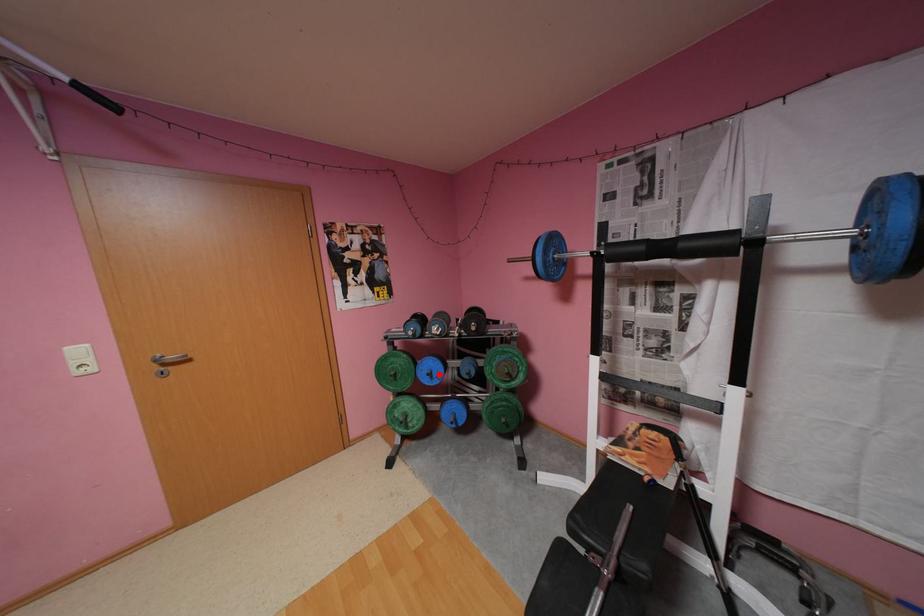
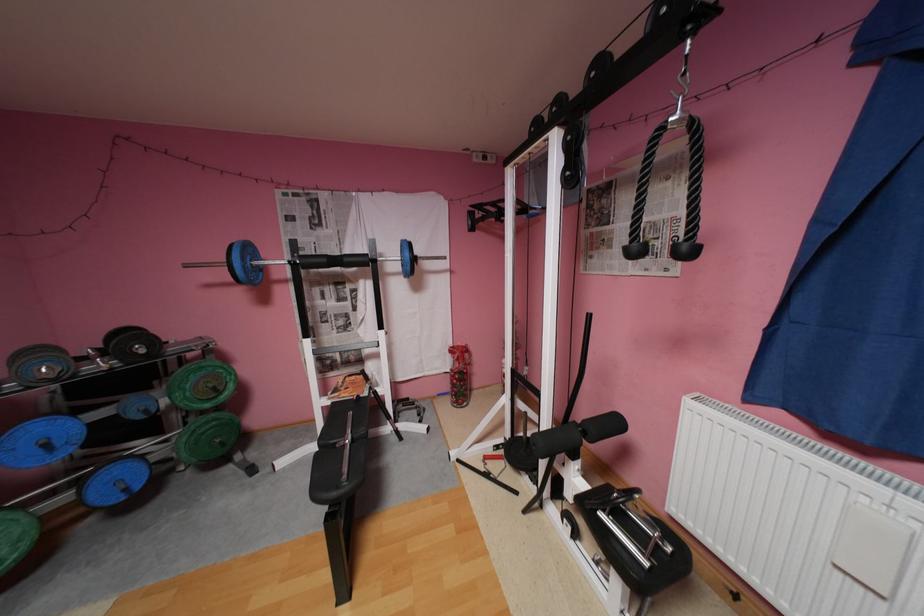
The point at the highlighted location is marked in the first image. Where is the corresponding point in the second image?

(55, 445)